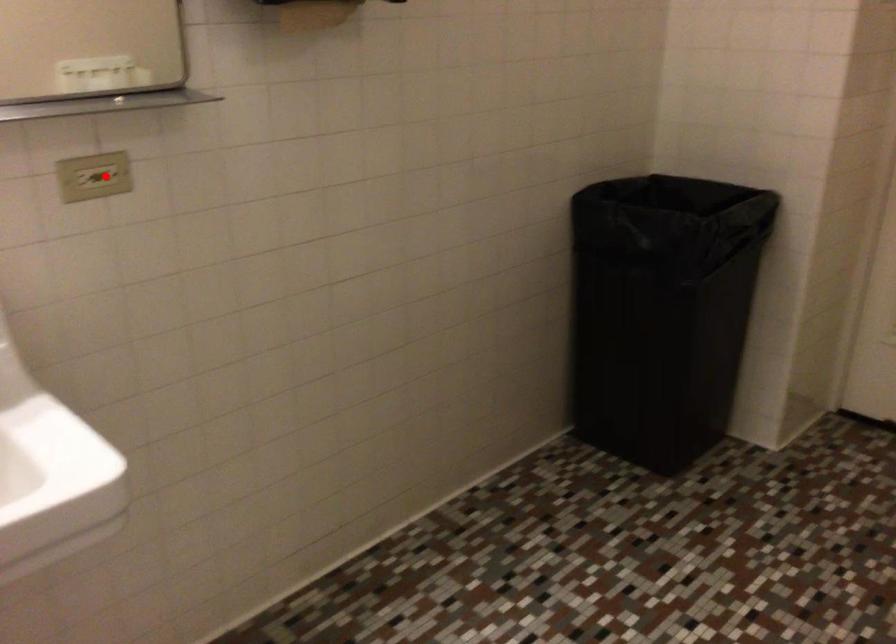
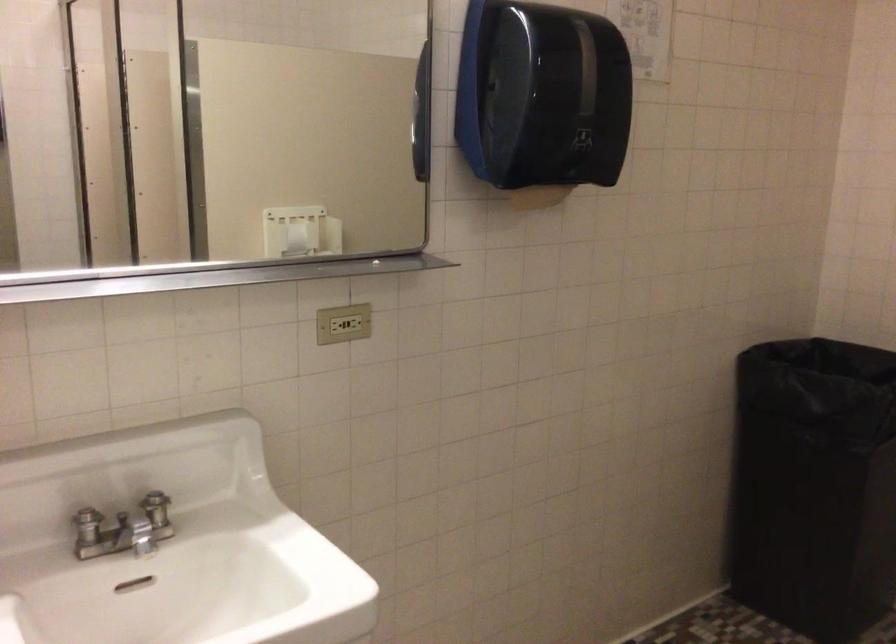
Find the pixel in the second image that matches the highlighted location in the first image.

(342, 323)